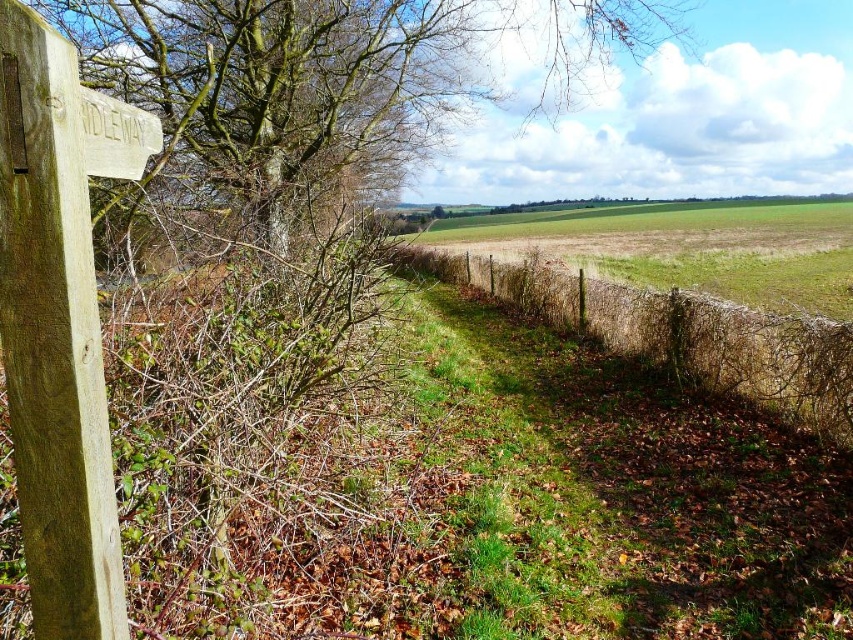
Who is lower down, brown bark tree at upper left or wooden signpost at left?

→ wooden signpost at left is below.

Does brown bark tree at upper left appear on the left side of wooden signpost at left?

Incorrect, brown bark tree at upper left is not on the left side of wooden signpost at left.

Is point (363, 115) positioned in front of point (148, 154)?

No, (363, 115) is behind (148, 154).

The width and height of the screenshot is (853, 640). In order to click on brown bark tree at upper left in this screenshot , I will do `click(334, 77)`.